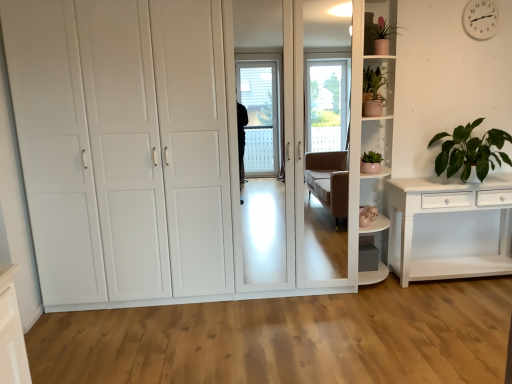
Question: Can you confirm if white plastic clock at upper right is taller than green leafy plant at right, the 3th houseplant viewed from the left?

Choices:
 (A) no
 (B) yes

Answer: (A)

Question: Does white plastic clock at upper right have a greater width compared to green leafy plant at right, marked as the first houseplant in a right-to-left arrangement?

Choices:
 (A) no
 (B) yes

Answer: (A)

Question: From the image's perspective, is white plastic clock at upper right under green leafy plant at right, the 3th houseplant viewed from the left?

Choices:
 (A) yes
 (B) no

Answer: (B)

Question: From a real-world perspective, is white plastic clock at upper right positioned under green leafy plant at right, marked as the first houseplant in a right-to-left arrangement, based on gravity?

Choices:
 (A) no
 (B) yes

Answer: (A)

Question: Would you say white plastic clock at upper right is a long distance from green leafy plant at right, marked as the first houseplant in a right-to-left arrangement?

Choices:
 (A) yes
 (B) no

Answer: (B)

Question: Looking at the image, does white glossy cupboard at center seem bigger or smaller compared to matte pink pot at upper right, which appears as the second shelf when ordered from the bottom?

Choices:
 (A) small
 (B) big

Answer: (B)

Question: Looking at their shapes, would you say white glossy cupboard at center is wider or thinner than matte pink pot at upper right, which appears as the second shelf when ordered from the bottom?

Choices:
 (A) wide
 (B) thin

Answer: (A)

Question: From the image's perspective, is white glossy cupboard at center positioned above or below matte pink pot at upper right, acting as the 1th shelf starting from the top?

Choices:
 (A) below
 (B) above

Answer: (A)

Question: Considering the positions of white glossy cupboard at center and matte pink pot at upper right, acting as the 1th shelf starting from the top, in the image, is white glossy cupboard at center taller or shorter than matte pink pot at upper right, acting as the 1th shelf starting from the top,?

Choices:
 (A) tall
 (B) short

Answer: (A)

Question: Would you say white glossy cupboard at center is to the left or to the right of matte pink pot at upper right, the 3th houseplant when ordered from right to left, in the picture?

Choices:
 (A) left
 (B) right

Answer: (A)

Question: Is white glossy cupboard at center situated inside matte pink pot at upper right, the 3th houseplant when ordered from right to left, or outside?

Choices:
 (A) inside
 (B) outside

Answer: (B)

Question: From a real-world perspective, is white glossy cupboard at center above or below matte pink pot at upper right, acting as the 1th houseplant starting from the left?

Choices:
 (A) below
 (B) above

Answer: (B)

Question: Is white glossy cupboard at center taller or shorter than matte pink pot at upper right, the 3th houseplant when ordered from right to left?

Choices:
 (A) tall
 (B) short

Answer: (A)

Question: Considering the positions of green leafy plant at right, the 3th houseplant viewed from the left, and green matte plant at upper right, the 2th houseplant positioned from the right, in the image, is green leafy plant at right, the 3th houseplant viewed from the left, taller or shorter than green matte plant at upper right, the 2th houseplant positioned from the right,?

Choices:
 (A) short
 (B) tall

Answer: (B)

Question: Considering the positions of green leafy plant at right, the 3th houseplant viewed from the left, and green matte plant at upper right, the 2th houseplant positioned from the right, in the image, is green leafy plant at right, the 3th houseplant viewed from the left, wider or thinner than green matte plant at upper right, the 2th houseplant positioned from the right,?

Choices:
 (A) wide
 (B) thin

Answer: (A)